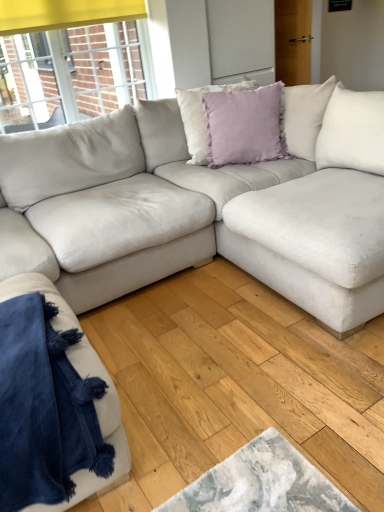
What is the approximate width of lavender velvet pillow at upper center, which is the 1th pillow from front to back?

lavender velvet pillow at upper center, which is the 1th pillow from front to back, is 7.75 inches in width.

Locate an element on the screen. The height and width of the screenshot is (512, 384). lavender velvet pillow at upper center, the 2th pillow when ordered from back to front is located at coordinates (245, 126).

Is point (201, 153) in front of point (116, 463)?

No, it is behind (116, 463).

Considering the positions of objects lavender velvet pillow at center, the first pillow positioned from the back, and velvet blue blanket at lower left in the image provided, who is in front, lavender velvet pillow at center, the first pillow positioned from the back, or velvet blue blanket at lower left?

velvet blue blanket at lower left is closer to the camera.

Is lavender velvet pillow at center, the first pillow positioned from the back, in contact with velvet blue blanket at lower left?

There is a gap between lavender velvet pillow at center, the first pillow positioned from the back, and velvet blue blanket at lower left.

Looking at this image, is lavender velvet pillow at center, marked as the second pillow in a front-to-back arrangement, facing away from velvet blue blanket at lower left?

No, lavender velvet pillow at center, marked as the second pillow in a front-to-back arrangement,'s orientation is not away from velvet blue blanket at lower left.

Is the depth of lavender velvet pillow at upper center, which is the 1th pillow from front to back, less than that of lavender velvet pillow at center, the first pillow positioned from the back?

Yes, lavender velvet pillow at upper center, which is the 1th pillow from front to back, is closer to the viewer.

Would you say lavender velvet pillow at upper center, the 2th pillow when ordered from back to front, is a long distance from lavender velvet pillow at center, marked as the second pillow in a front-to-back arrangement?

No.

Considering the points (229, 136) and (199, 92), which point is behind, point (229, 136) or point (199, 92)?

Point (199, 92)

Consider the image. Is lavender velvet pillow at upper center, the 2th pillow when ordered from back to front, shorter than lavender velvet pillow at center, the first pillow positioned from the back?

Correct, lavender velvet pillow at upper center, the 2th pillow when ordered from back to front, is not as tall as lavender velvet pillow at center, the first pillow positioned from the back.

Who is bigger, lavender velvet pillow at upper center, the 2th pillow when ordered from back to front, or velvet blue blanket at lower left?

velvet blue blanket at lower left.

Considering the positions of points (224, 119) and (77, 361), is point (224, 119) closer to camera compared to point (77, 361)?

That is False.

From the image's perspective, count 1st pillows upward from the velvet blue blanket at lower left and point to it. Please provide its 2D coordinates.

[(245, 126)]

Does lavender velvet pillow at upper center, which is the 1th pillow from front to back, lie in front of velvet blue blanket at lower left?

No, the depth of lavender velvet pillow at upper center, which is the 1th pillow from front to back, is greater than that of velvet blue blanket at lower left.

Can you tell me how much lavender velvet pillow at center, the first pillow positioned from the back, and lavender velvet pillow at upper center, which is the 1th pillow from front to back, differ in facing direction?

The angular difference between lavender velvet pillow at center, the first pillow positioned from the back, and lavender velvet pillow at upper center, which is the 1th pillow from front to back, is 17 degrees.

Which is less distant, (x=206, y=92) or (x=211, y=146)?

Point (x=206, y=92) is closer to the camera than point (x=211, y=146).

In the scene shown: Would you say lavender velvet pillow at center, the first pillow positioned from the back, is a long distance from lavender velvet pillow at upper center, which is the 1th pillow from front to back?

No, lavender velvet pillow at center, the first pillow positioned from the back, is in close proximity to lavender velvet pillow at upper center, which is the 1th pillow from front to back.

From the picture: Is lavender velvet pillow at center, marked as the second pillow in a front-to-back arrangement, facing away from lavender velvet pillow at upper center, the 2th pillow when ordered from back to front?

That's right, lavender velvet pillow at center, marked as the second pillow in a front-to-back arrangement, is facing away from lavender velvet pillow at upper center, the 2th pillow when ordered from back to front.

Which object is wider, velvet blue blanket at lower left or lavender velvet pillow at center, the first pillow positioned from the back?

velvet blue blanket at lower left is wider.

Where is `studio couch below the lavender velvet pillow at center, marked as the second pillow in a front-to-back arrangement (from a real-world perspective)`? The image size is (384, 512). studio couch below the lavender velvet pillow at center, marked as the second pillow in a front-to-back arrangement (from a real-world perspective) is located at coordinates coord(101,431).

In the scene shown: Is velvet blue blanket at lower left in front of or behind lavender velvet pillow at center, the first pillow positioned from the back, in the image?

In the image, velvet blue blanket at lower left appears in front of lavender velvet pillow at center, the first pillow positioned from the back.

Considering the relative sizes of velvet blue blanket at lower left and lavender velvet pillow at center, marked as the second pillow in a front-to-back arrangement, in the image provided, is velvet blue blanket at lower left taller than lavender velvet pillow at center, marked as the second pillow in a front-to-back arrangement,?

No.

Is velvet blue blanket at lower left directly adjacent to lavender velvet pillow at upper center, which is the 1th pillow from front to back?

No, velvet blue blanket at lower left is not making contact with lavender velvet pillow at upper center, which is the 1th pillow from front to back.

How different are the orientations of velvet blue blanket at lower left and lavender velvet pillow at upper center, the 2th pillow when ordered from back to front, in degrees?

There is a 35-degree angle between the facing directions of velvet blue blanket at lower left and lavender velvet pillow at upper center, the 2th pillow when ordered from back to front.

From the image's perspective, relative to lavender velvet pillow at upper center, the 2th pillow when ordered from back to front, is velvet blue blanket at lower left above or below?

Based on their image positions, velvet blue blanket at lower left is located beneath lavender velvet pillow at upper center, the 2th pillow when ordered from back to front.

Who is taller, velvet blue blanket at lower left or lavender velvet pillow at upper center, which is the 1th pillow from front to back?

With more height is lavender velvet pillow at upper center, which is the 1th pillow from front to back.

This screenshot has width=384, height=512. Find the location of `the 1st pillow counting from the right side of the velvet blue blanket at lower left`. the 1st pillow counting from the right side of the velvet blue blanket at lower left is located at coordinates (202, 117).

This screenshot has width=384, height=512. I want to click on pillow below the lavender velvet pillow at upper center, which is the 1th pillow from front to back (from a real-world perspective), so click(x=202, y=117).

Which object lies nearer to the anchor point lavender velvet pillow at upper center, which is the 1th pillow from front to back, lavender velvet pillow at center, the first pillow positioned from the back, or velvet blue blanket at lower left?

Among the two, lavender velvet pillow at center, the first pillow positioned from the back, is located nearer to lavender velvet pillow at upper center, which is the 1th pillow from front to back.

Looking at the image, which one is located closer to velvet blue blanket at lower left, lavender velvet pillow at center, marked as the second pillow in a front-to-back arrangement, or lavender velvet pillow at upper center, the 2th pillow when ordered from back to front?

lavender velvet pillow at upper center, the 2th pillow when ordered from back to front, is closer to velvet blue blanket at lower left.

From the image, which object appears to be nearer to lavender velvet pillow at upper center, which is the 1th pillow from front to back, velvet blue blanket at lower left or lavender velvet pillow at center, the first pillow positioned from the back?

lavender velvet pillow at center, the first pillow positioned from the back, lies closer to lavender velvet pillow at upper center, which is the 1th pillow from front to back, than the other object.

Based on their spatial positions, is lavender velvet pillow at upper center, which is the 1th pillow from front to back, or velvet blue blanket at lower left closer to lavender velvet pillow at center, marked as the second pillow in a front-to-back arrangement?

lavender velvet pillow at upper center, which is the 1th pillow from front to back, is closer to lavender velvet pillow at center, marked as the second pillow in a front-to-back arrangement.

Based on their spatial positions, is lavender velvet pillow at upper center, which is the 1th pillow from front to back, or lavender velvet pillow at center, marked as the second pillow in a front-to-back arrangement, further from velvet blue blanket at lower left?

The object further to velvet blue blanket at lower left is lavender velvet pillow at center, marked as the second pillow in a front-to-back arrangement.

Looking at the image, which one is located closer to lavender velvet pillow at center, marked as the second pillow in a front-to-back arrangement, velvet blue blanket at lower left or lavender velvet pillow at upper center, which is the 1th pillow from front to back?

Among the two, lavender velvet pillow at upper center, which is the 1th pillow from front to back, is located nearer to lavender velvet pillow at center, marked as the second pillow in a front-to-back arrangement.

Find the location of `pillow between velvet blue blanket at lower left and lavender velvet pillow at center, the first pillow positioned from the back, from front to back`. pillow between velvet blue blanket at lower left and lavender velvet pillow at center, the first pillow positioned from the back, from front to back is located at coordinates (245, 126).